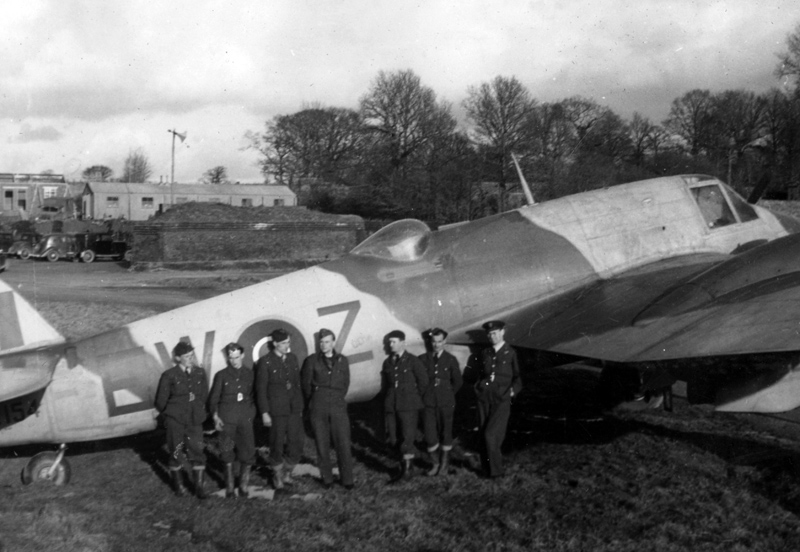
Where is `speaker`? This screenshot has height=552, width=800. speaker is located at coordinates (180, 139).